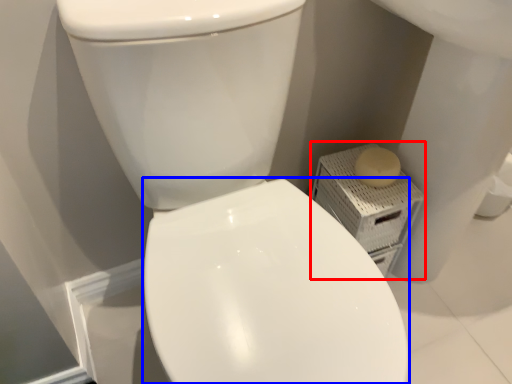
Question: Which object appears farthest to the camera in this image, porcelain (highlighted by a red box) or bidet (highlighted by a blue box)?

Choices:
 (A) porcelain
 (B) bidet

Answer: (A)